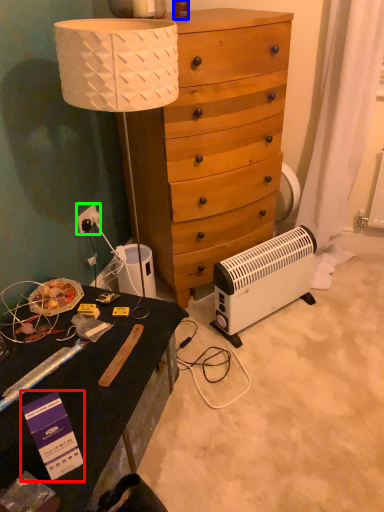
Question: Considering the real-world distances, which object is farthest from box (highlighted by a red box)? bottle (highlighted by a blue box) or power outlet (highlighted by a green box)?

Choices:
 (A) bottle
 (B) power outlet

Answer: (A)